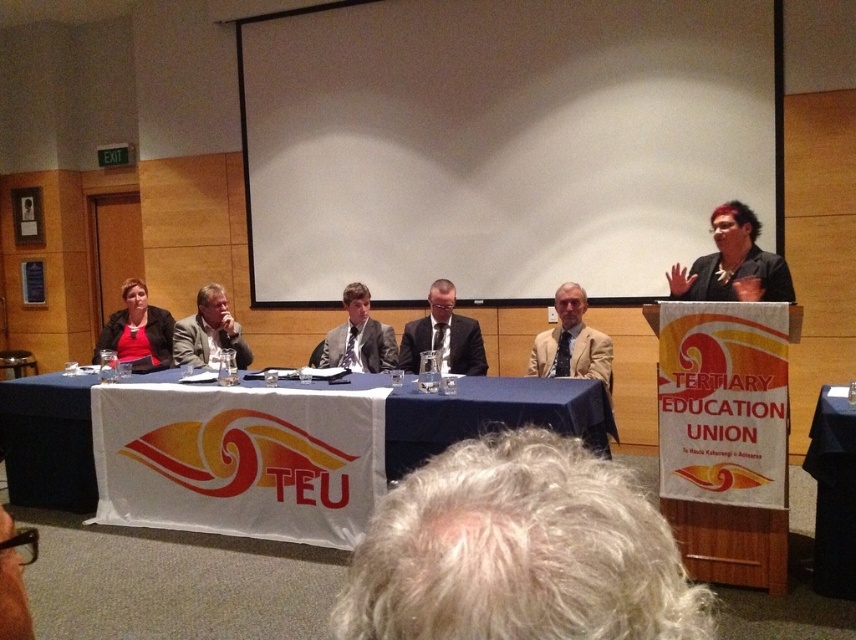
Question: Is black fabric at upper right bigger than matte black jacket at left?

Choices:
 (A) yes
 (B) no

Answer: (B)

Question: Which point is closer to the camera?

Choices:
 (A) (352, 321)
 (B) (434, 324)
 (C) (176, 342)
 (D) (742, 214)

Answer: (D)

Question: Can you confirm if gray hair at center is positioned to the left of black fabric at upper right?

Choices:
 (A) yes
 (B) no

Answer: (A)

Question: Can you confirm if white matte projection screen at upper center is smaller than tan fabric suit at center?

Choices:
 (A) no
 (B) yes

Answer: (A)

Question: Which point appears farthest from the camera in this image?

Choices:
 (A) (197, 316)
 (B) (382, 364)
 (C) (126, 291)

Answer: (C)

Question: Which of the following is the closest to the observer?

Choices:
 (A) gray hair at center
 (B) matte gray suit at center

Answer: (A)